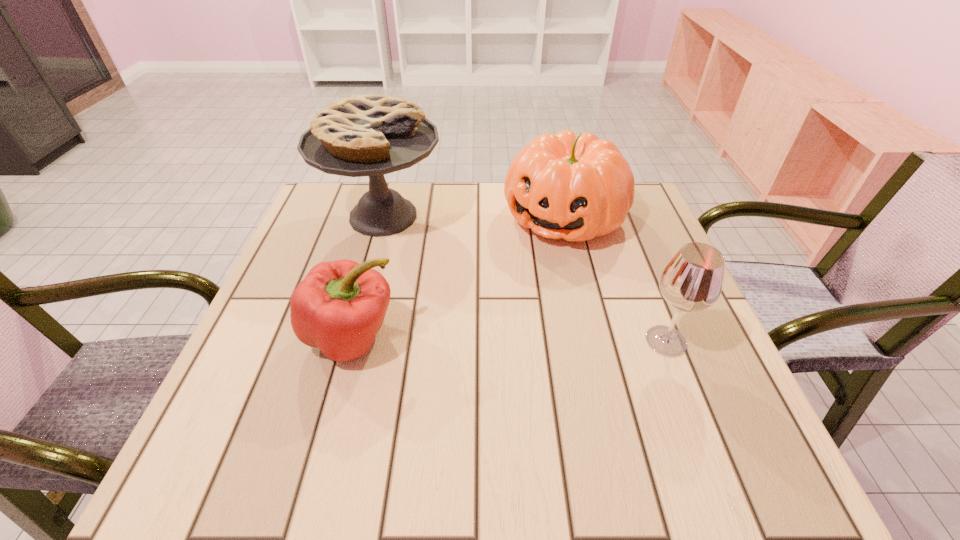
Locate an element on the screen. free space on the desktop that is between the shortest object and the wineglass and is positioned on the carved face of the pumpkin is located at coordinates (472, 339).

You are a GUI agent. You are given a task and a screenshot of the screen. Output one action in this format:
    pyautogui.click(x=<x>, y=<y>)
    Task: Click on the vacant space on the desktop that is between the bell pepper and the wineglass and is positioned on the cut side of the tallest object
    Image resolution: width=960 pixels, height=540 pixels.
    Given the screenshot: What is the action you would take?
    pyautogui.click(x=542, y=339)